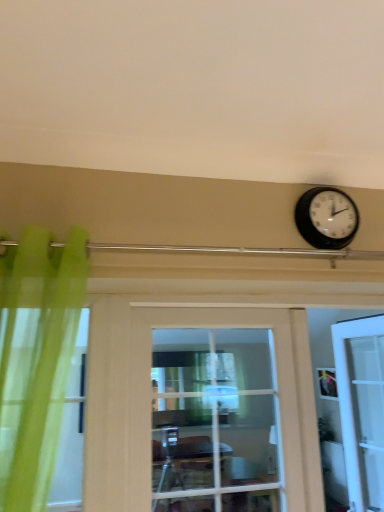
Question: Considering the positions of point (329, 196) and point (369, 506), is point (329, 196) closer or farther from the camera than point (369, 506)?

Choices:
 (A) farther
 (B) closer

Answer: (B)

Question: Relative to white glossy door at right, which is the 1th door in right-to-left order, is black plastic wall clock at upper right in front or behind?

Choices:
 (A) behind
 (B) front

Answer: (B)

Question: Which object is the farthest from the white glossy door at right, which ranks as the 2th door in left-to-right order?

Choices:
 (A) clear glass door at center, the second door from the back
 (B) black plastic wall clock at upper right

Answer: (B)

Question: Which of these objects is positioned farthest from the black plastic wall clock at upper right?

Choices:
 (A) white glossy door at right, marked as the first door in a back-to-front arrangement
 (B) clear glass door at center, the second door from the back

Answer: (A)